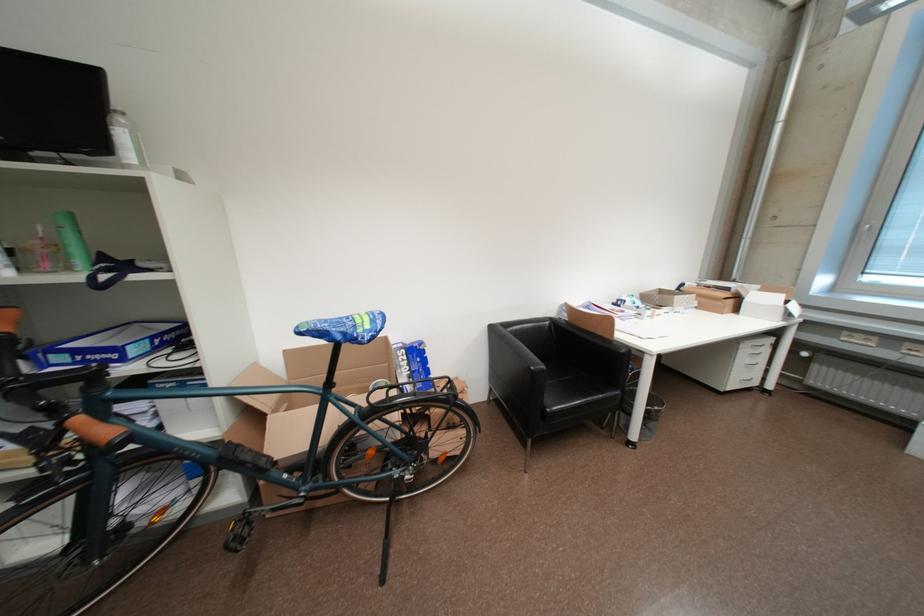
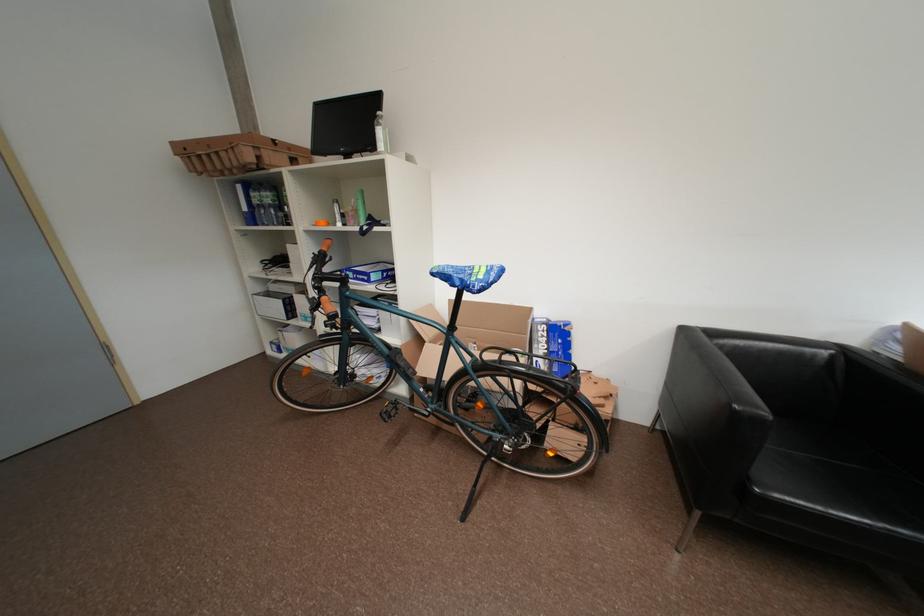
Locate, in the second image, the point that corresponds to (244,539) in the first image.

(395, 414)